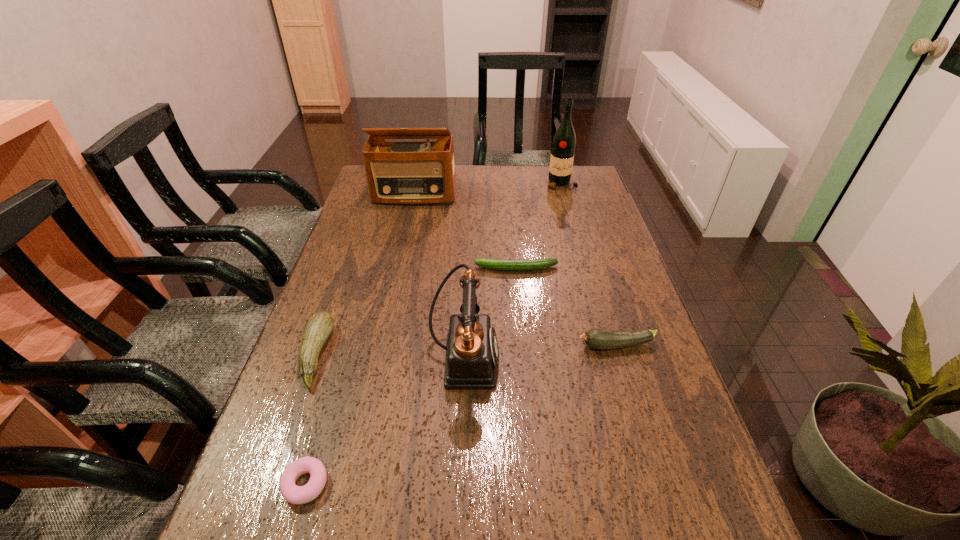
The image size is (960, 540). I want to click on vacant space at the far edge, so click(x=479, y=192).

Find the location of `free region at the left edge of the desktop`. free region at the left edge of the desktop is located at coordinates (272, 481).

The image size is (960, 540). In the image, there is a desktop. In order to click on free space at the right edge in this screenshot , I will do `click(643, 305)`.

Where is `vacant point located between the leftmost zucchini and the wine bottle`? This screenshot has width=960, height=540. vacant point located between the leftmost zucchini and the wine bottle is located at coordinates (439, 269).

You are a GUI agent. You are given a task and a screenshot of the screen. Output one action in this format:
    pyautogui.click(x=<x>, y=<y>)
    Task: Click on the vacant area between the nearest object and the rightmost zucchini
    The width and height of the screenshot is (960, 540).
    Given the screenshot: What is the action you would take?
    pyautogui.click(x=461, y=415)

At what (x,y) coordinates should I click in order to perform the action: click on vacant point located between the telephone and the pastry. Please return your answer as a coordinate pair (x, y). Looking at the image, I should click on (385, 421).

Find the location of a particular element. This screenshot has width=960, height=540. free space between the radio receiver and the second zucchini from right to left is located at coordinates (465, 232).

Find the location of a particular element. free point between the nearest object and the rightmost zucchini is located at coordinates (461, 415).

This screenshot has width=960, height=540. I want to click on vacant space that is in between the pastry and the fifth tallest object, so click(x=461, y=415).

Where is `free space between the radio receiver and the third tallest object`? The image size is (960, 540). free space between the radio receiver and the third tallest object is located at coordinates (439, 276).